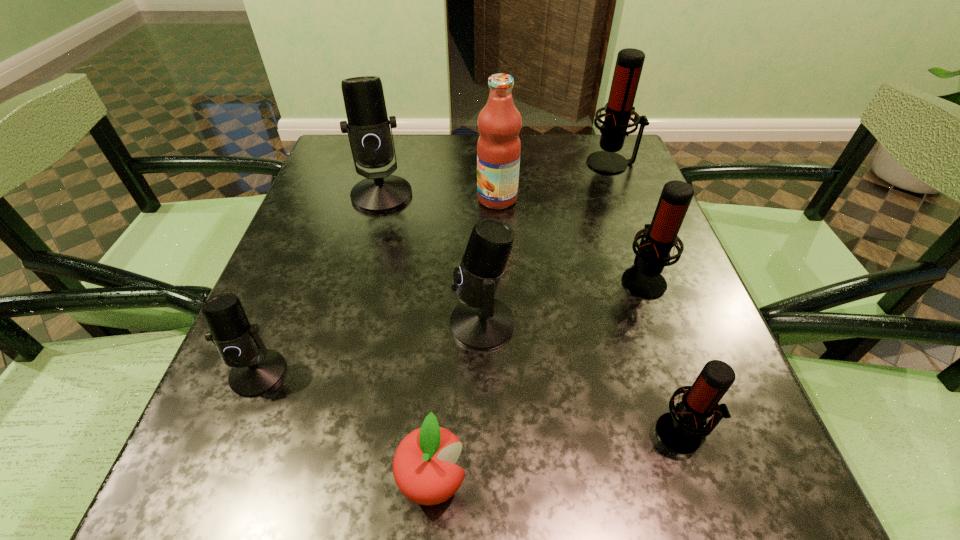
Locate an element on the screen. fruit juice is located at coordinates (499, 147).

Locate an element on the screen. The image size is (960, 540). the farthest object is located at coordinates 619,110.

Where is `the farthest microphone`? The height and width of the screenshot is (540, 960). the farthest microphone is located at coordinates (619, 110).

Where is `the second black microphone from right to left`? the second black microphone from right to left is located at coordinates (368, 128).

This screenshot has height=540, width=960. Find the location of `the farthest black microphone`. the farthest black microphone is located at coordinates tap(368, 128).

Where is `the fifth nearest object`? The image size is (960, 540). the fifth nearest object is located at coordinates (644, 280).

The image size is (960, 540). I want to click on the second biggest red microphone, so click(x=644, y=280).

At what (x,y) coordinates should I click in order to perform the action: click on the fourth microphone from right to left. Please return your answer as a coordinate pair (x, y). This screenshot has width=960, height=540. Looking at the image, I should click on click(480, 322).

The height and width of the screenshot is (540, 960). What are the coordinates of `the third nearest microphone` in the screenshot? It's located at (480, 322).

Where is `the nearest microphone`? the nearest microphone is located at coordinates (681, 431).